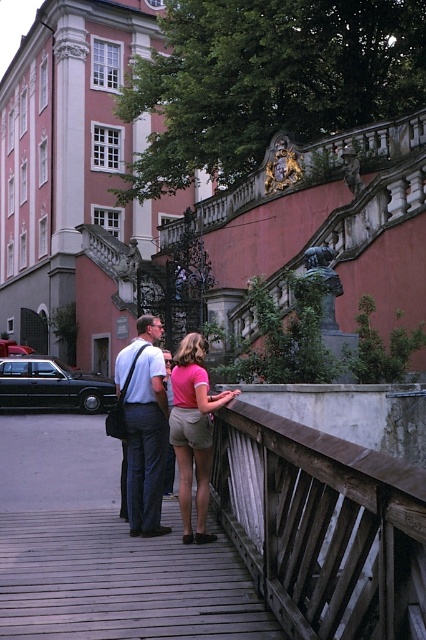
The image size is (426, 640). What are the coordinates of `matte pink shirt at center` in the screenshot? It's located at (144, 426).

Is matte pink shirt at center bigger than matte white shirt at center?

Indeed, matte pink shirt at center has a larger size compared to matte white shirt at center.

Which is behind, point (166, 529) or point (143, 440)?

Positioned behind is point (166, 529).

At what (x,y) coordinates should I click in order to perform the action: click on matte pink shirt at center. Please return your answer as a coordinate pair (x, y). Looking at the image, I should click on (144, 426).

Between point (103, 339) and point (172, 392), which one is positioned behind?

Positioned behind is point (103, 339).

Is point (28, 36) positioned after point (166, 349)?

Yes, point (28, 36) is farther from viewer.

Is point (101, 221) closer to camera compared to point (169, 460)?

No.

I want to click on matte pink building at upper left, so click(75, 177).

Between wooden at center and matte white shirt at center, which one has less height?

matte white shirt at center

Can you confirm if wooden at center is positioned to the right of matte white shirt at center?

Correct, you'll find wooden at center to the right of matte white shirt at center.

This screenshot has height=640, width=426. What are the coordinates of `wooden at center` in the screenshot? It's located at (322, 525).

Where is `wooden at center`? wooden at center is located at coordinates 322,525.